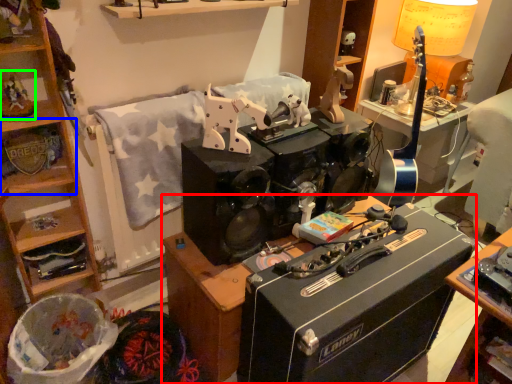
Question: Which object is the farthest from desk (highlighted by a red box)? Choose among these: shelf (highlighted by a blue box) or toy (highlighted by a green box).

Choices:
 (A) shelf
 (B) toy

Answer: (B)